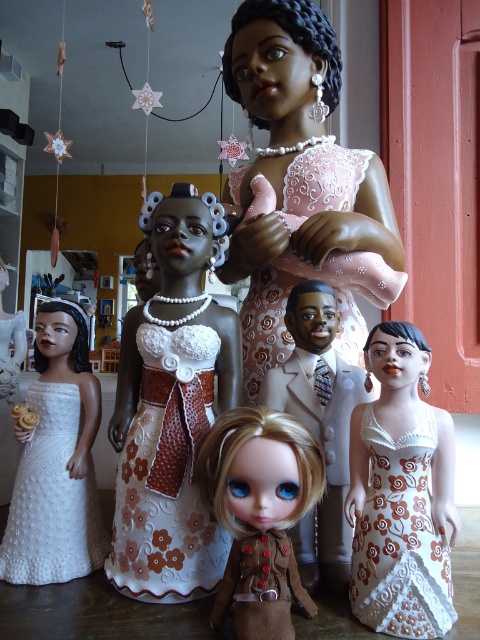
Question: Observing the image, what is the correct spatial positioning of white fabric dress at center in reference to white satin suit at center?

Choices:
 (A) left
 (B) right

Answer: (B)

Question: Which object is positioned farthest from the white textured dress at lower left?

Choices:
 (A) white satin suit at center
 (B) pink lace dress at center

Answer: (B)

Question: Estimate the real-world distances between objects in this image. Which object is farther from the white satin suit at center?

Choices:
 (A) matte brown doll at center
 (B) white textured dress at lower left
 (C) white fabric dress at center

Answer: (B)

Question: Is matte brown doll at center positioned at the back of white satin suit at center?

Choices:
 (A) yes
 (B) no

Answer: (B)

Question: Where is white satin suit at center located in relation to white textured dress at lower left in the image?

Choices:
 (A) right
 (B) left

Answer: (A)

Question: Which point is farther to the camera?

Choices:
 (A) (98, 548)
 (B) (271, 342)

Answer: (B)